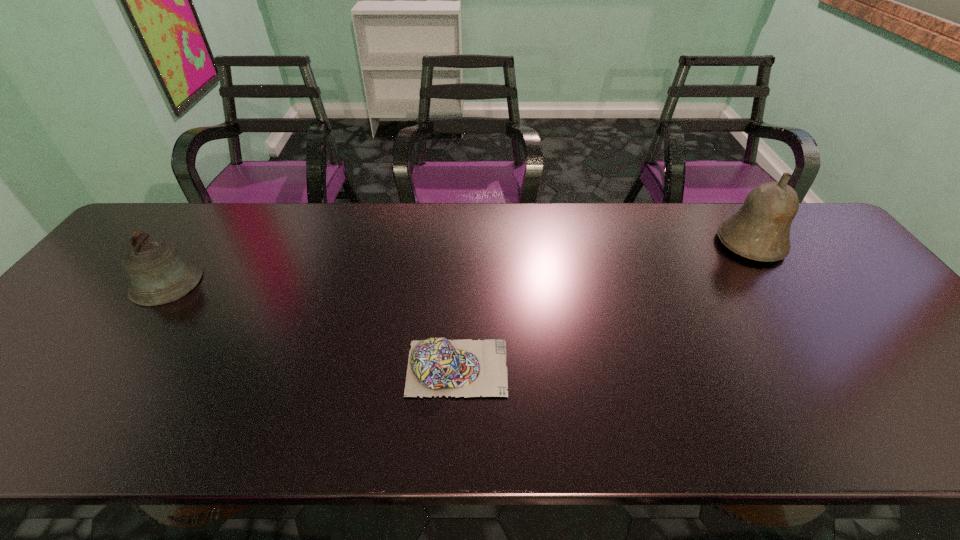
Identify the location of the right bell. (760, 230).

The width and height of the screenshot is (960, 540). I want to click on the taller bell, so click(760, 230).

The image size is (960, 540). I want to click on the left bell, so 159,274.

At what (x,y) coordinates should I click in order to perform the action: click on the second shortest object. Please return your answer as a coordinate pair (x, y). The image size is (960, 540). Looking at the image, I should click on (159, 274).

Where is `cap`? Image resolution: width=960 pixels, height=540 pixels. cap is located at coordinates (436, 366).

Image resolution: width=960 pixels, height=540 pixels. In order to click on the shortest object in this screenshot , I will do `click(436, 366)`.

The image size is (960, 540). Identify the location of vacant area situated on the front of the tallest object. (833, 363).

Locate an element on the screen. Image resolution: width=960 pixels, height=540 pixels. blank space located 0.190m on the back of the left bell is located at coordinates (212, 220).

What are the coordinates of `free space located on the front, side, and top of the shortest object` in the screenshot? It's located at (529, 368).

The height and width of the screenshot is (540, 960). What are the coordinates of `object positioned at the far edge` in the screenshot? It's located at (760, 230).